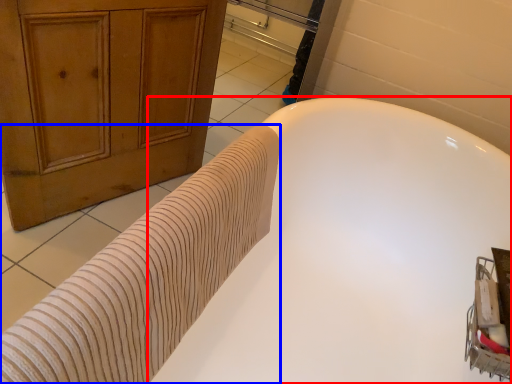
Question: Among these objects, which one is farthest to the camera, bathtub (highlighted by a red box) or bath towel (highlighted by a blue box)?

Choices:
 (A) bathtub
 (B) bath towel

Answer: (B)